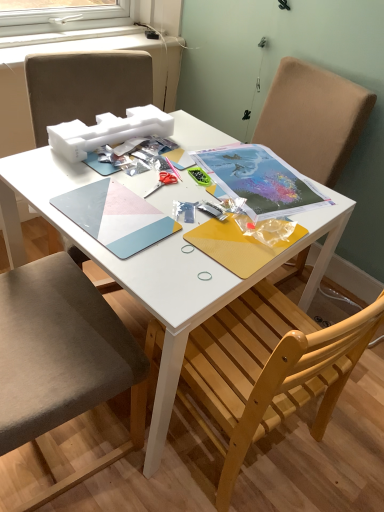
Question: Is matte plastic notebook at center, the 2th notebook when ordered from right to left, aimed at metallic silver scissors at center?

Choices:
 (A) no
 (B) yes

Answer: (A)

Question: From a real-world perspective, is matte plastic notebook at center, which ranks as the 1th notebook in left-to-right order, located beneath metallic silver scissors at center?

Choices:
 (A) no
 (B) yes

Answer: (A)

Question: From a real-world perspective, is matte plastic notebook at center, which ranks as the 1th notebook in left-to-right order, physically above metallic silver scissors at center?

Choices:
 (A) no
 (B) yes

Answer: (B)

Question: Considering the relative sizes of matte plastic notebook at center, which ranks as the 1th notebook in left-to-right order, and metallic silver scissors at center in the image provided, is matte plastic notebook at center, which ranks as the 1th notebook in left-to-right order, smaller than metallic silver scissors at center?

Choices:
 (A) no
 (B) yes

Answer: (A)

Question: From the image's perspective, would you say matte plastic notebook at center, which ranks as the 1th notebook in left-to-right order, is positioned over metallic silver scissors at center?

Choices:
 (A) yes
 (B) no

Answer: (B)

Question: Is fabric cushioned chair at left, which ranks as the first chair in left-to-right order, wider or thinner than metallic silver scissors at center?

Choices:
 (A) wide
 (B) thin

Answer: (A)

Question: In terms of height, does fabric cushioned chair at left, which ranks as the first chair in left-to-right order, look taller or shorter compared to metallic silver scissors at center?

Choices:
 (A) tall
 (B) short

Answer: (A)

Question: Does point (23, 305) appear closer or farther from the camera than point (170, 181)?

Choices:
 (A) closer
 (B) farther

Answer: (A)

Question: Is fabric cushioned chair at left, which ranks as the first chair in left-to-right order, bigger or smaller than metallic silver scissors at center?

Choices:
 (A) big
 (B) small

Answer: (A)

Question: From their relative heights in the image, would you say matte paper notebook at center, which is the second notebook from left to right, is taller or shorter than fabric cushioned chair at left, which appears as the second chair when viewed from the right?

Choices:
 (A) short
 (B) tall

Answer: (A)

Question: Is matte paper notebook at center, which is the second notebook from left to right, spatially inside fabric cushioned chair at left, which appears as the second chair when viewed from the right, or outside of it?

Choices:
 (A) inside
 (B) outside

Answer: (B)

Question: Is matte paper notebook at center, which is the second notebook from left to right, to the left or to the right of fabric cushioned chair at left, which ranks as the first chair in left-to-right order, in the image?

Choices:
 (A) left
 (B) right

Answer: (B)

Question: Considering the positions of matte paper notebook at center, the 1th notebook from the right, and fabric cushioned chair at left, which ranks as the first chair in left-to-right order, in the image, is matte paper notebook at center, the 1th notebook from the right, wider or thinner than fabric cushioned chair at left, which ranks as the first chair in left-to-right order,?

Choices:
 (A) wide
 (B) thin

Answer: (B)

Question: Is matte paper notebook at center, which is the second notebook from left to right, bigger or smaller than metallic silver scissors at center?

Choices:
 (A) small
 (B) big

Answer: (B)

Question: From a real-world perspective, is matte paper notebook at center, which is the second notebook from left to right, above or below metallic silver scissors at center?

Choices:
 (A) above
 (B) below

Answer: (B)